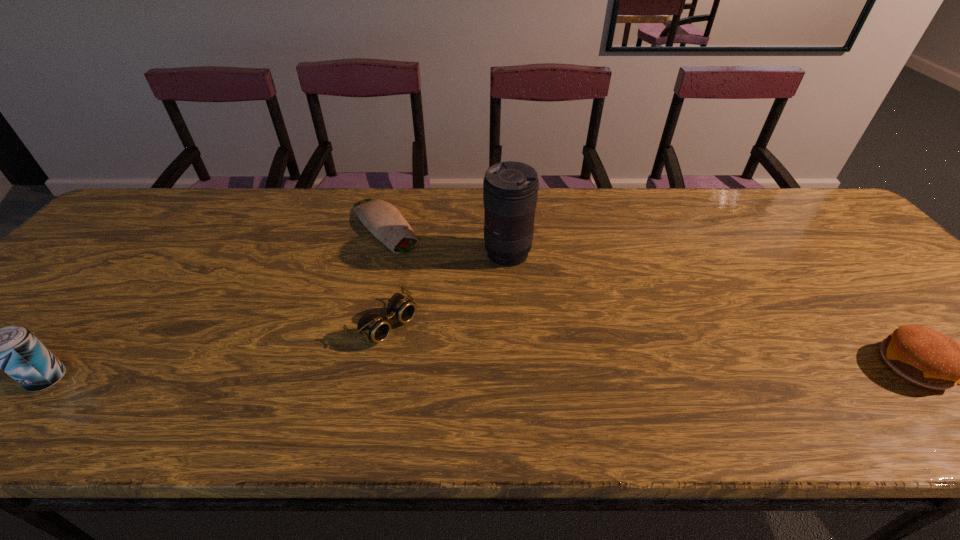
Find the location of `vacant region located at the bitten end of the burrito`. vacant region located at the bitten end of the burrito is located at coordinates (449, 300).

The image size is (960, 540). Find the location of `free space located at the bitten end of the burrito`. free space located at the bitten end of the burrito is located at coordinates (439, 289).

Where is `vacant space located at the bitten end of the burrito`? This screenshot has width=960, height=540. vacant space located at the bitten end of the burrito is located at coordinates (436, 286).

You are a GUI agent. You are given a task and a screenshot of the screen. Output one action in this format:
    pyautogui.click(x=<x>, y=<y>)
    Task: Click on the free region located 0.080m through the lenses of the goggles
    
    Given the screenshot: What is the action you would take?
    pyautogui.click(x=431, y=360)

Find the location of a particular element. This screenshot has width=960, height=540. vacant space located 0.180m through the lenses of the goggles is located at coordinates (466, 387).

The width and height of the screenshot is (960, 540). I want to click on vacant space situated 0.190m through the lenses of the goggles, so click(469, 390).

Image resolution: width=960 pixels, height=540 pixels. I want to click on object present at the far edge, so click(382, 219).

Locate an element on the screen. This screenshot has width=960, height=540. object positioned at the near edge is located at coordinates (14, 349).

This screenshot has width=960, height=540. I want to click on object located in the left edge section of the desktop, so click(x=14, y=349).

You are a GUI agent. You are given a task and a screenshot of the screen. Output one action in this format:
    pyautogui.click(x=<x>, y=<y>)
    Task: Click on the object at the near left corner
    This screenshot has width=960, height=540.
    Given the screenshot: What is the action you would take?
    pyautogui.click(x=14, y=349)